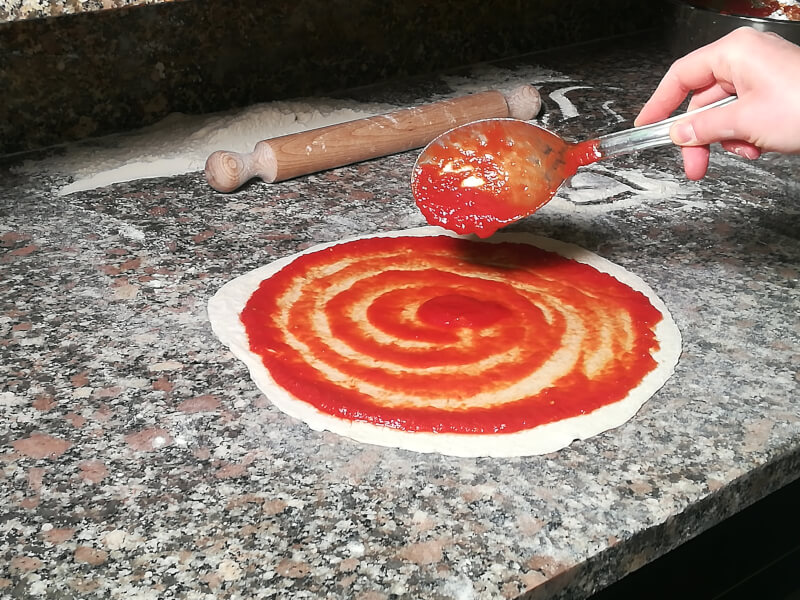
The image size is (800, 600). I want to click on empty space on counter, so click(x=170, y=491).